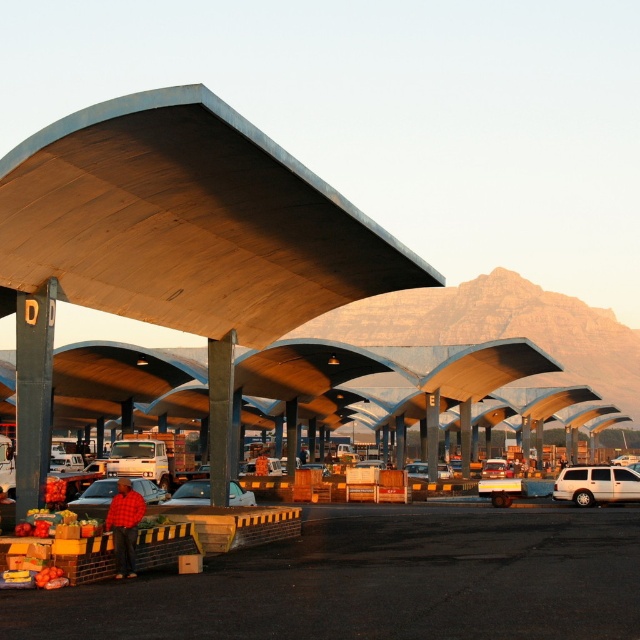
Who is more distant from viewer, (573,486) or (490,467)?

Point (490,467)

Which of these two, silver metallic station wagon at right or metallic silver van at center, stands shorter?

With less height is metallic silver van at center.

Does point (554, 486) come behind point (483, 476)?

That is False.

At what (x,y) coordinates should I click in order to perform the action: click on silver metallic station wagon at right. Please return your answer as a coordinate pair (x, y). Looking at the image, I should click on (596, 484).

Describe the element at coordinates (596, 484) in the screenshot. I see `silver metallic station wagon at right` at that location.

Who is positioned more to the left, silver metallic station wagon at right or metallic silver car at center?

metallic silver car at center is more to the left.

Is point (573, 484) positioned in front of point (228, 481)?

That is False.

Find the location of a particular element. This screenshot has height=640, width=640. silver metallic station wagon at right is located at coordinates (596, 484).

Which is more to the left, matte black car at center or metallic silver van at center?

matte black car at center is more to the left.

Locate an element on the screen. matte black car at center is located at coordinates (97, 493).